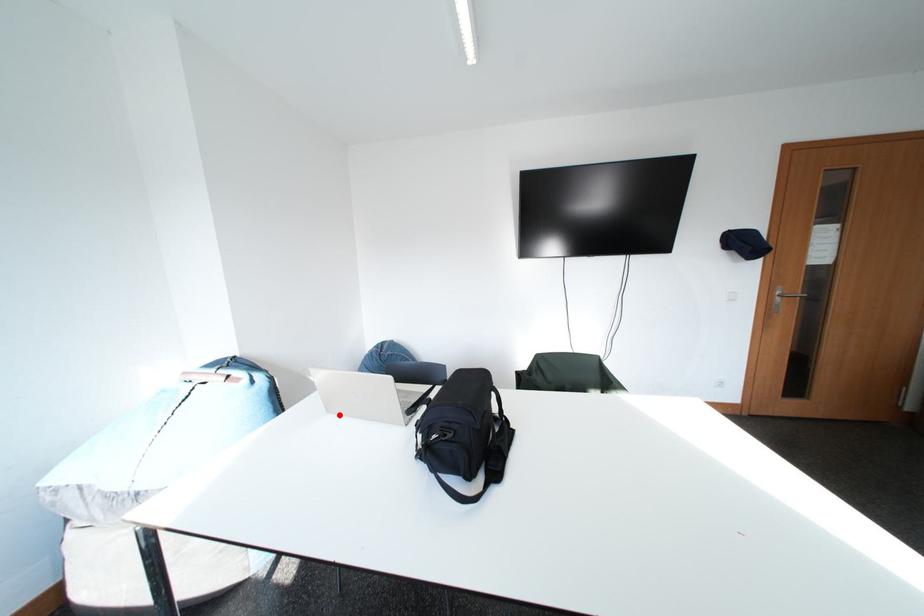
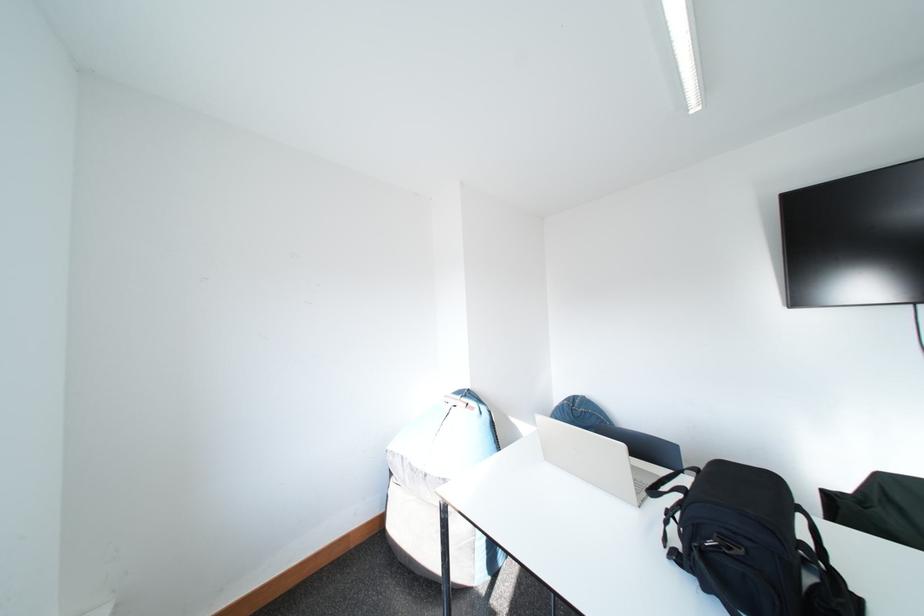
Find the pixel in the second image that matches the highlighted location in the first image.

(557, 463)